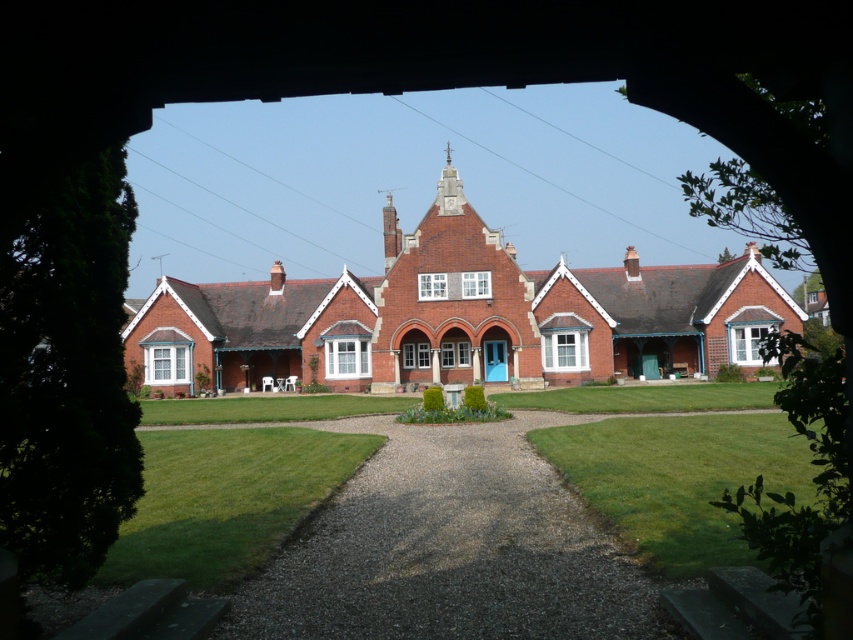
Looking at this image, is dark gray gravel driveway at center taller than green grass at lower center?

No.

Based on the photo, which of these two, dark gray gravel driveway at center or green grass at lower center, stands shorter?

dark gray gravel driveway at center

The image size is (853, 640). Find the location of `dark gray gravel driveway at center`. dark gray gravel driveway at center is located at coordinates click(x=450, y=548).

Where is `dark gray gravel driveway at center`? dark gray gravel driveway at center is located at coordinates (450, 548).

Between point (666, 573) and point (276, 436), which one is positioned behind?

The point (276, 436) is behind.

Can you confirm if green grass at lower center is positioned to the right of green grass at lower left?

Yes, green grass at lower center is to the right of green grass at lower left.

Who is more forward, (614, 520) or (206, 556)?

Positioned in front is point (206, 556).

This screenshot has height=640, width=853. Find the location of `green grass at lower center`. green grass at lower center is located at coordinates pyautogui.click(x=680, y=481).

Who is positioned more to the left, dark gray gravel driveway at center or green grass at lower left?

Positioned to the left is green grass at lower left.

Is point (422, 620) in front of point (262, 465)?

Yes, it is.

Is point (579, 524) positioned in front of point (262, 468)?

Yes.

Locate an element on the screen. dark gray gravel driveway at center is located at coordinates (450, 548).